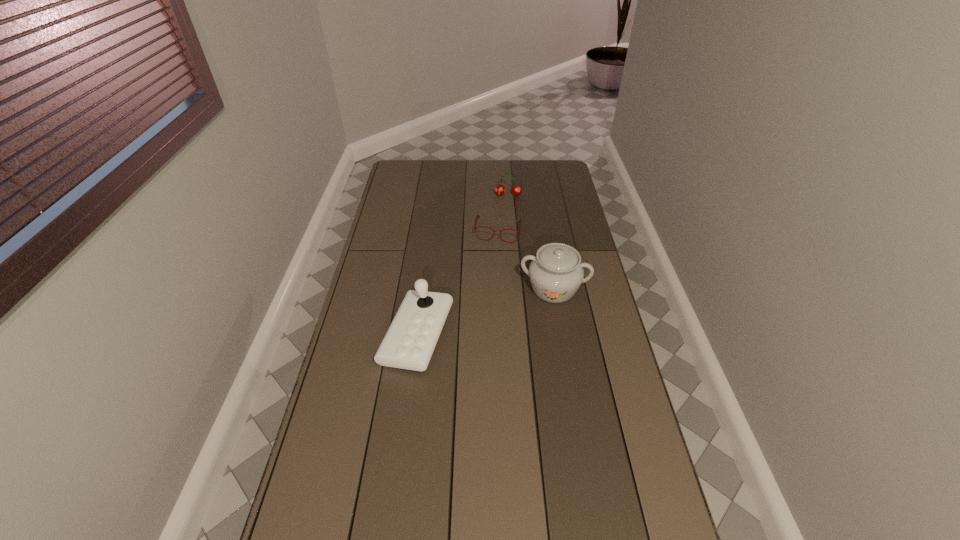
This screenshot has width=960, height=540. Identify the location of empty location between the chinaware and the farthest object. [531, 242].

Locate an element on the screen. This screenshot has height=540, width=960. free area in between the joystick and the third nearest object is located at coordinates (458, 283).

The image size is (960, 540). I want to click on vacant region between the cherry and the shortest object, so click(503, 213).

At what (x,y) coordinates should I click in order to perform the action: click on empty space that is in between the spectacles and the cherry. Please return your answer as a coordinate pair (x, y). Looking at the image, I should click on (503, 213).

I want to click on unoccupied area between the joystick and the second farthest object, so click(458, 283).

This screenshot has width=960, height=540. In order to click on free space between the second farthest object and the joystick in this screenshot , I will do `click(458, 283)`.

I want to click on vacant space in between the joystick and the shortest object, so click(x=458, y=283).

Identify the location of object that is the closest to the leftmost object. The image size is (960, 540). (556, 272).

Point out which object is positioned as the second nearest to the leftmost object. Please provide its 2D coordinates. Your answer should be formatted as a tuple, i.e. [(x, y)], where the tuple contains the x and y coordinates of a point satisfying the conditions above.

[(475, 228)]

Identify the location of vacant space that satisfies the following two spatial constraints: 1. on the back side of the leftmost object; 2. on the right side of the shortest object. (431, 231).